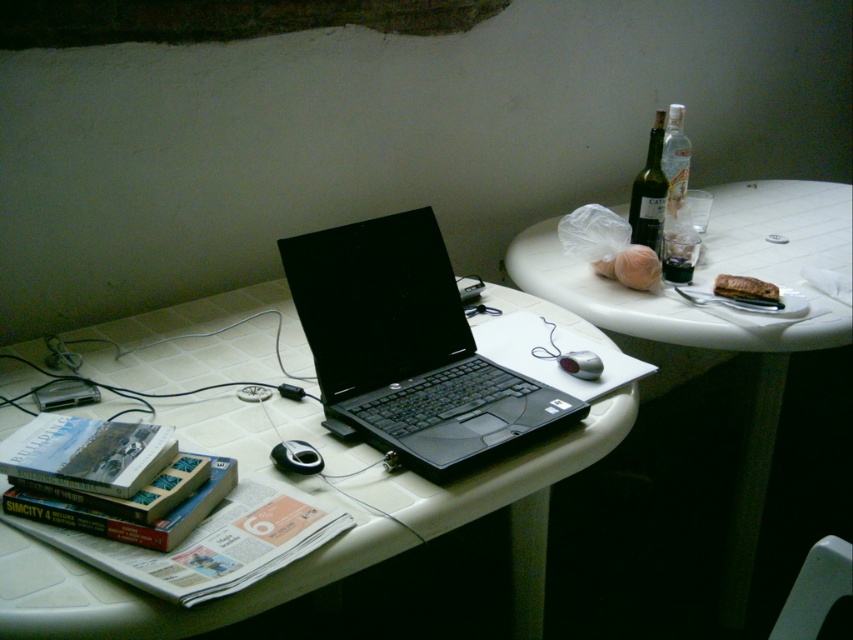
You are organizing your desk and want to place both the black plastic laptop at center and the black matte laptop at center side by side. Given that the white plastic table has enough space, which laptop should you place on the left to ensure they fit without overlapping?

Since the black plastic laptop at center is larger in size than the black matte laptop at center, you should place the black plastic laptop at center on the left to accommodate its larger size, ensuring they fit side by side without overlapping.

You are organizing items on the white plastic table. You need to place a new item between the clear glass bottle at upper right and the silver metallic mouse at center. Where should you place it?

The clear glass bottle at upper right is located above the silver metallic mouse at center, so you should place the new item in between them by positioning it below the bottle and above the mouse.